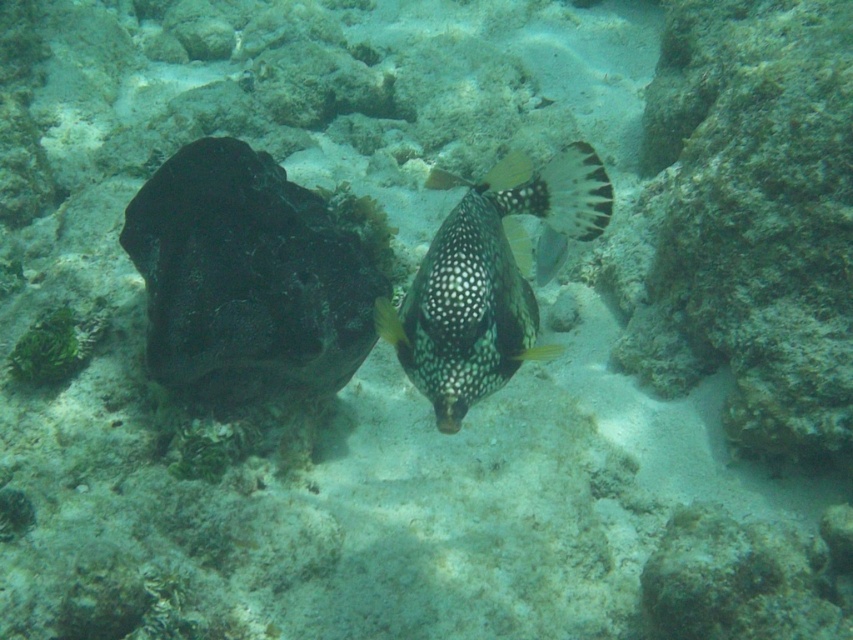
Does point (263, 300) lie in front of point (572, 192)?

That is False.

Is the position of speckled black fish at center more distant than that of speckled glossy fish at center?

Yes, it is behind speckled glossy fish at center.

Measure the distance between point (152, 284) and camera.

Point (152, 284) and camera are 4.90 feet apart.

The height and width of the screenshot is (640, 853). In order to click on speckled black fish at center in this screenshot , I will do `click(247, 278)`.